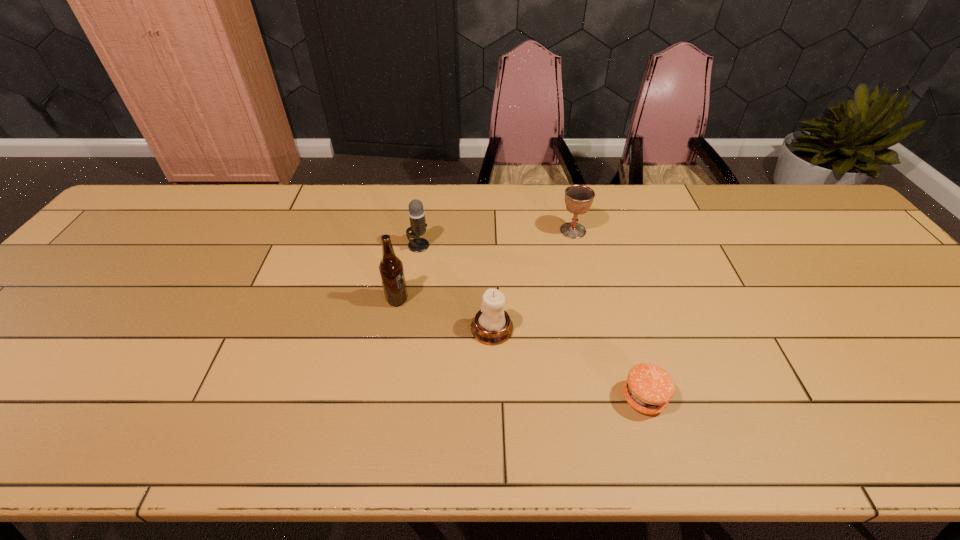
At what (x,y) coordinates should I click in order to perform the action: click on free space between the microphone and the chalice. Please return your answer as a coordinate pair (x, y). Looking at the image, I should click on pos(495,238).

Identify the location of vacant area between the nearest object and the chalice. This screenshot has height=540, width=960. (609, 314).

You are a GUI agent. You are given a task and a screenshot of the screen. Output one action in this format:
    pyautogui.click(x=<x>, y=<y>)
    Task: Click on the vacant point located between the patty and the chalice
    
    Given the screenshot: What is the action you would take?
    pyautogui.click(x=609, y=314)

Image resolution: width=960 pixels, height=540 pixels. What are the coordinates of `free point between the third object from left to right and the microphone` in the screenshot? It's located at (455, 287).

Where is `vacant area that lies between the microphone and the chalice`? vacant area that lies between the microphone and the chalice is located at coordinates (495, 238).

In order to click on vacant space that is in between the third object from right to left and the chalice in this screenshot , I will do `click(533, 280)`.

Locate an element on the screen. This screenshot has width=960, height=540. free space between the patty and the tallest object is located at coordinates (520, 349).

Where is `empty location between the microphone and the shortest object`? The width and height of the screenshot is (960, 540). empty location between the microphone and the shortest object is located at coordinates (531, 321).

Find the location of a particular element. This screenshot has width=960, height=540. free area in between the second nearest object and the patty is located at coordinates (568, 363).

Identify the location of the fourth closest object to the microphone. (648, 388).